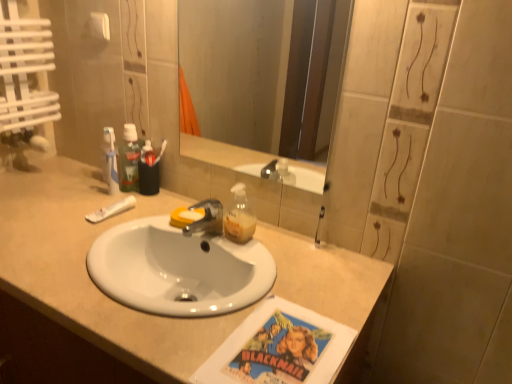
Question: Does white matte tube at left have a larger size compared to green plastic mouthwash at upper left?

Choices:
 (A) no
 (B) yes

Answer: (A)

Question: Does white matte tube at left have a lesser height compared to green plastic mouthwash at upper left?

Choices:
 (A) no
 (B) yes

Answer: (B)

Question: Is white matte tube at left facing away from green plastic mouthwash at upper left?

Choices:
 (A) yes
 (B) no

Answer: (B)

Question: Is white matte tube at left wider than green plastic mouthwash at upper left?

Choices:
 (A) no
 (B) yes

Answer: (B)

Question: From the image's perspective, is white matte tube at left beneath green plastic mouthwash at upper left?

Choices:
 (A) no
 (B) yes

Answer: (B)

Question: From a real-world perspective, does white matte tube at left stand above green plastic mouthwash at upper left?

Choices:
 (A) no
 (B) yes

Answer: (A)

Question: Is clear glass mirror at upper center positioned with its back to white matte tube at left?

Choices:
 (A) no
 (B) yes

Answer: (A)

Question: Is clear glass mirror at upper center to the left of white matte tube at left from the viewer's perspective?

Choices:
 (A) no
 (B) yes

Answer: (A)

Question: Is clear glass mirror at upper center thinner than white matte tube at left?

Choices:
 (A) no
 (B) yes

Answer: (B)

Question: Are clear glass mirror at upper center and white matte tube at left making contact?

Choices:
 (A) yes
 (B) no

Answer: (B)

Question: Is clear glass mirror at upper center further to camera compared to white matte tube at left?

Choices:
 (A) yes
 (B) no

Answer: (B)

Question: Are clear glass mirror at upper center and white matte tube at left far apart?

Choices:
 (A) no
 (B) yes

Answer: (B)

Question: Can you confirm if white matte tube at left is taller than beige laminate countertop at center?

Choices:
 (A) no
 (B) yes

Answer: (A)